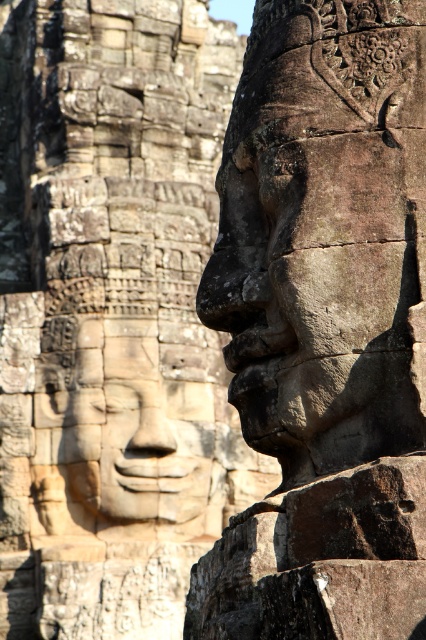
Question: Is weathered stone face at center further to camera compared to smooth stone face at center?

Choices:
 (A) no
 (B) yes

Answer: (A)

Question: Does weathered stone face at center have a greater width compared to smooth stone face at center?

Choices:
 (A) no
 (B) yes

Answer: (B)

Question: Is weathered stone face at center smaller than smooth stone face at center?

Choices:
 (A) no
 (B) yes

Answer: (A)

Question: Which of the following is the closest to the observer?

Choices:
 (A) smooth stone face at center
 (B) weathered stone face at center

Answer: (B)

Question: Which point is farther from the camera taking this photo?

Choices:
 (A) pyautogui.click(x=224, y=324)
 (B) pyautogui.click(x=129, y=456)

Answer: (B)